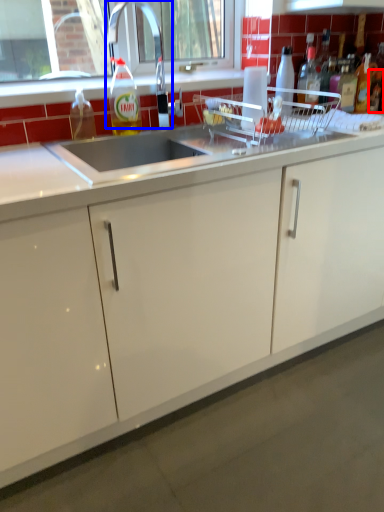
Question: Which point is further to the camera, bottle (highlighted by a red box) or faucet (highlighted by a blue box)?

Choices:
 (A) bottle
 (B) faucet

Answer: (A)